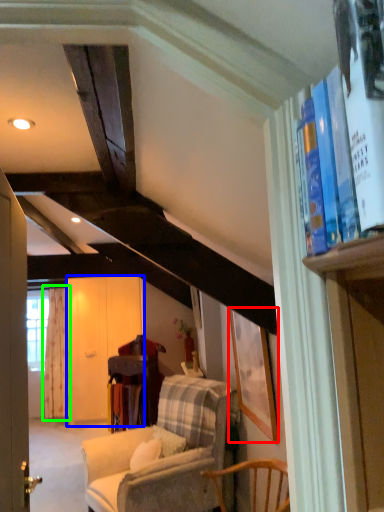
Question: Considering the real-world distances, which object is closest to picture frame (highlighted by a red box)? screen door (highlighted by a blue box) or curtain (highlighted by a green box).

Choices:
 (A) screen door
 (B) curtain

Answer: (A)